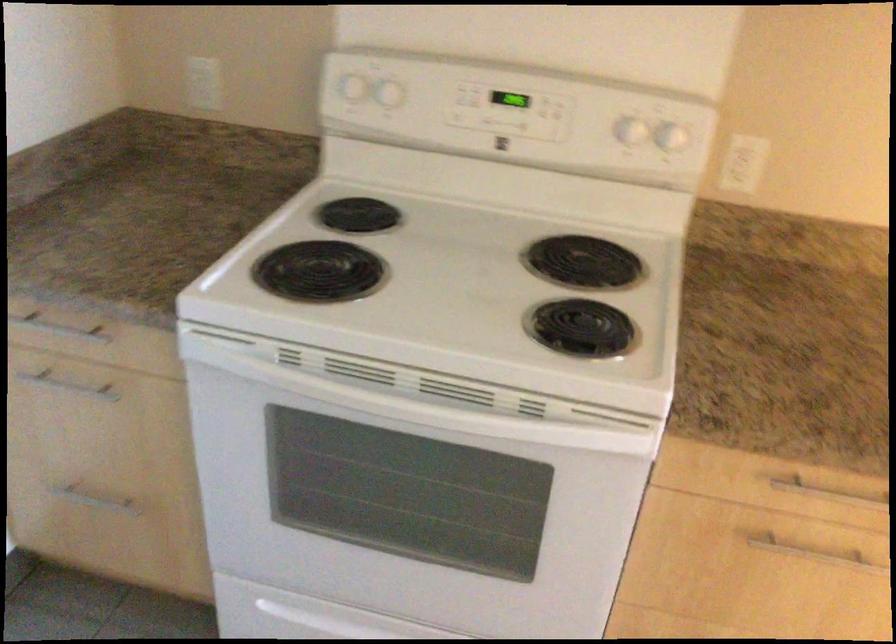
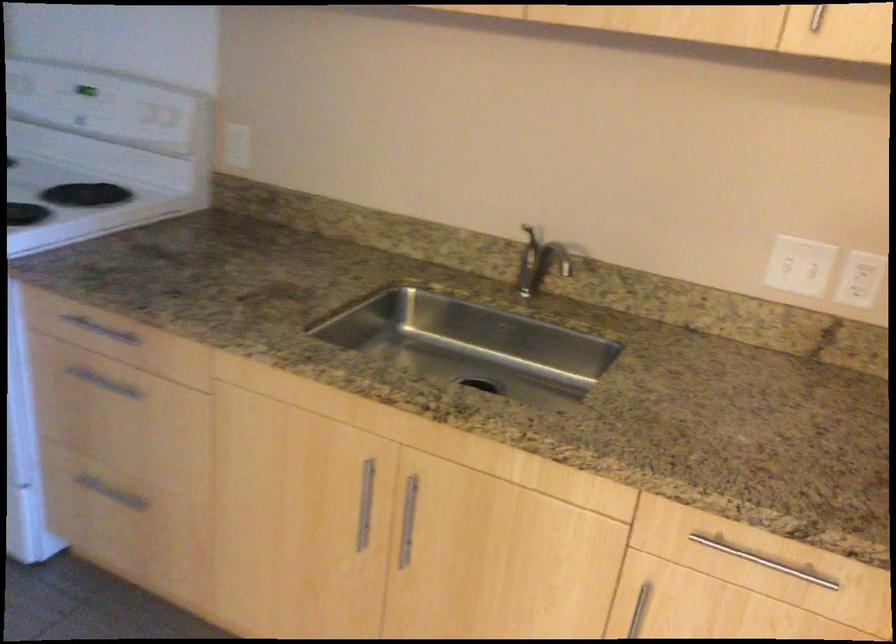
Locate, in the second image, the point that corresponds to point (497, 96) in the first image.

(85, 90)